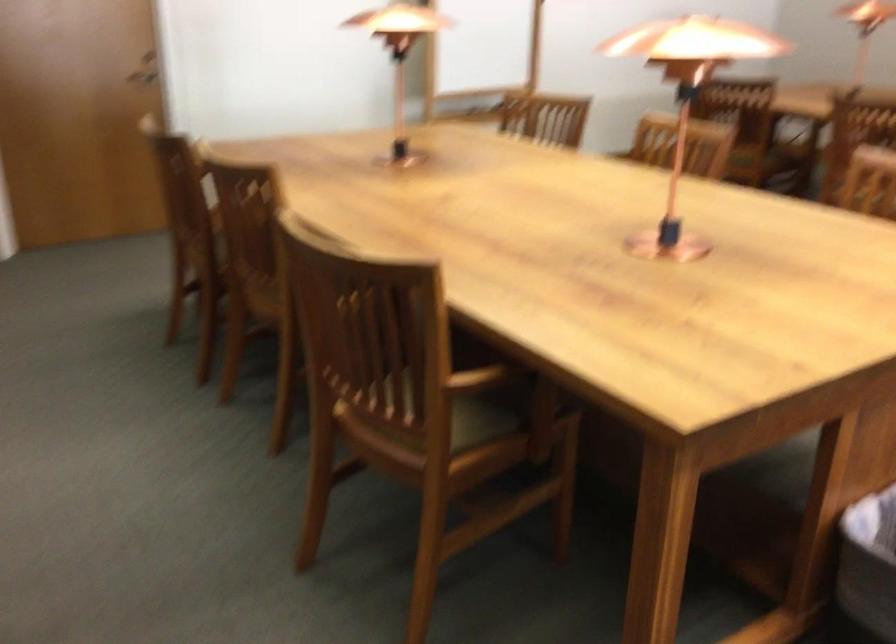
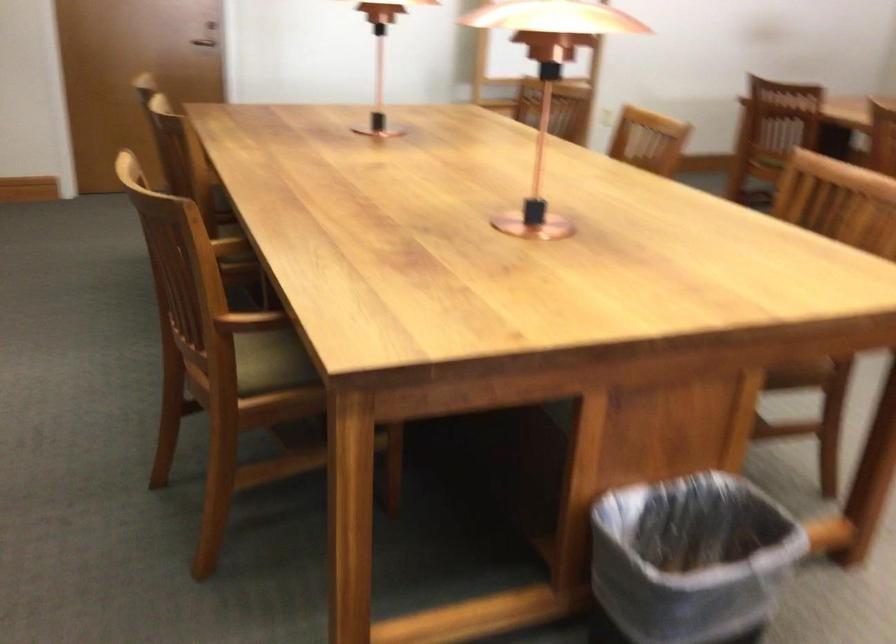
The point at (167, 80) is marked in the first image. Where is the corresponding point in the second image?

(202, 42)